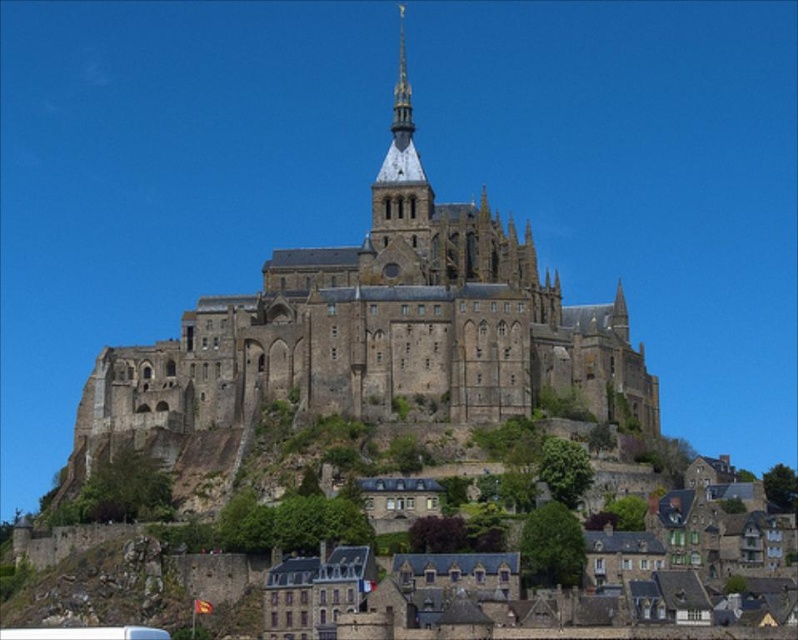
Is stone castle at center positioned behind white plastic bus at lower left?

Yes.

Which of these two, stone castle at center or white plastic bus at lower left, stands shorter?

Answer: Standing shorter between the two is white plastic bus at lower left.

The image size is (798, 640). Identify the location of stone castle at center. (376, 332).